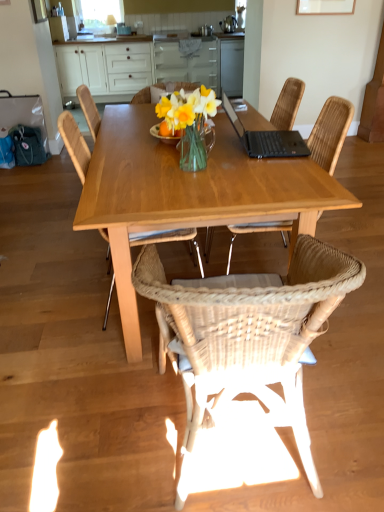
Question: From a real-world perspective, is woven wood chair at center, which is the 3th chair from right to left, located beneath woven rattan chair at center, arranged as the 2th chair when viewed from the left?

Choices:
 (A) yes
 (B) no

Answer: (B)

Question: Considering the relative sizes of woven wood chair at center, which is the 3th chair from right to left, and woven rattan chair at center, which is counted as the 2th chair, starting from the right, in the image provided, is woven wood chair at center, which is the 3th chair from right to left, thinner than woven rattan chair at center, which is counted as the 2th chair, starting from the right,?

Choices:
 (A) no
 (B) yes

Answer: (B)

Question: Does woven wood chair at center, positioned as the first chair in left-to-right order, come in front of woven rattan chair at center, which is counted as the 2th chair, starting from the right?

Choices:
 (A) yes
 (B) no

Answer: (B)

Question: Is woven wood chair at center, which is the 3th chair from right to left, at the right side of woven rattan chair at center, arranged as the 2th chair when viewed from the left?

Choices:
 (A) no
 (B) yes

Answer: (A)

Question: Can we say woven wood chair at center, which is the 3th chair from right to left, lies outside woven rattan chair at center, which is counted as the 2th chair, starting from the right?

Choices:
 (A) no
 (B) yes

Answer: (B)

Question: Is transparent glass window screen at upper center bigger or smaller than woven rattan chair at center, arranged as the 2th chair when viewed from the left?

Choices:
 (A) big
 (B) small

Answer: (B)

Question: From a real-world perspective, is transparent glass window screen at upper center physically located above or below woven rattan chair at center, arranged as the 2th chair when viewed from the left?

Choices:
 (A) below
 (B) above

Answer: (B)

Question: Looking at their shapes, would you say transparent glass window screen at upper center is wider or thinner than woven rattan chair at center, arranged as the 2th chair when viewed from the left?

Choices:
 (A) thin
 (B) wide

Answer: (A)

Question: From the image's perspective, is transparent glass window screen at upper center positioned above or below woven rattan chair at center, which is counted as the 2th chair, starting from the right?

Choices:
 (A) above
 (B) below

Answer: (A)

Question: Considering the positions of white wood cabinets at upper center and woven rattan chair at center, which is counted as the 2th chair, starting from the right, in the image, is white wood cabinets at upper center bigger or smaller than woven rattan chair at center, which is counted as the 2th chair, starting from the right,?

Choices:
 (A) big
 (B) small

Answer: (A)

Question: Is white wood cabinets at upper center situated inside woven rattan chair at center, which is counted as the 2th chair, starting from the right, or outside?

Choices:
 (A) inside
 (B) outside

Answer: (B)

Question: In terms of height, does white wood cabinets at upper center look taller or shorter compared to woven rattan chair at center, arranged as the 2th chair when viewed from the left?

Choices:
 (A) tall
 (B) short

Answer: (A)

Question: Relative to woven rattan chair at center, which is counted as the 2th chair, starting from the right, is white wood cabinets at upper center in front or behind?

Choices:
 (A) front
 (B) behind

Answer: (B)

Question: In terms of width, does woven wood chair at center, positioned as the first chair in left-to-right order, look wider or thinner when compared to woven rattan chair at center, the third chair viewed from the left?

Choices:
 (A) thin
 (B) wide

Answer: (A)

Question: Based on their sizes in the image, would you say woven wood chair at center, positioned as the first chair in left-to-right order, is bigger or smaller than woven rattan chair at center, the third chair viewed from the left?

Choices:
 (A) small
 (B) big

Answer: (A)